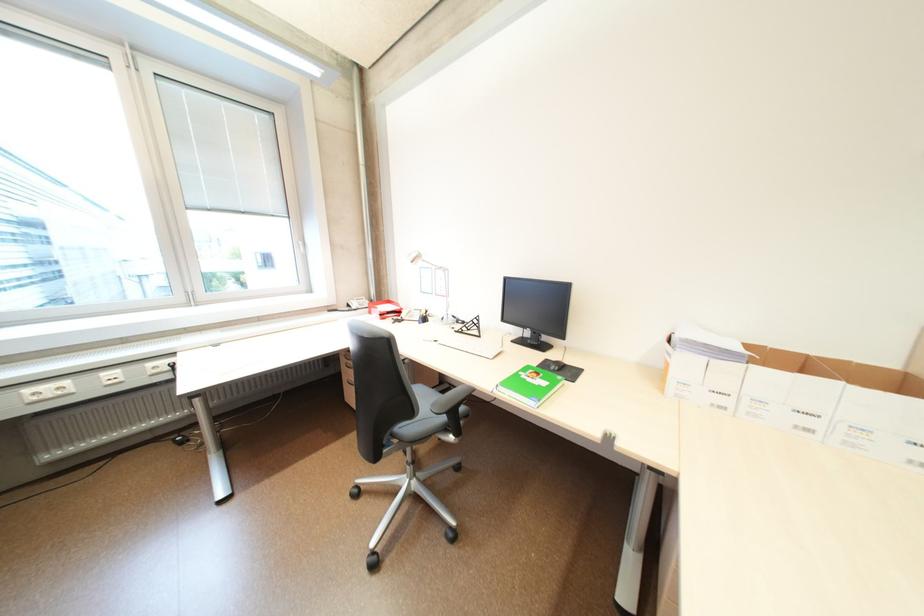
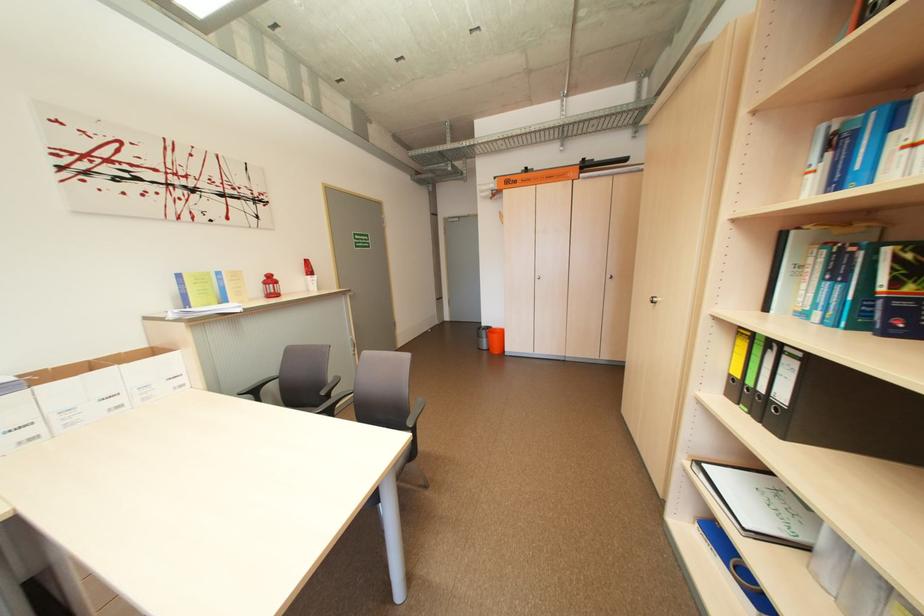
The first image is from the beginning of the video and the second image is from the end. How did the camera likely rotate when shooting the video?

The rotation direction of the camera is right-down.